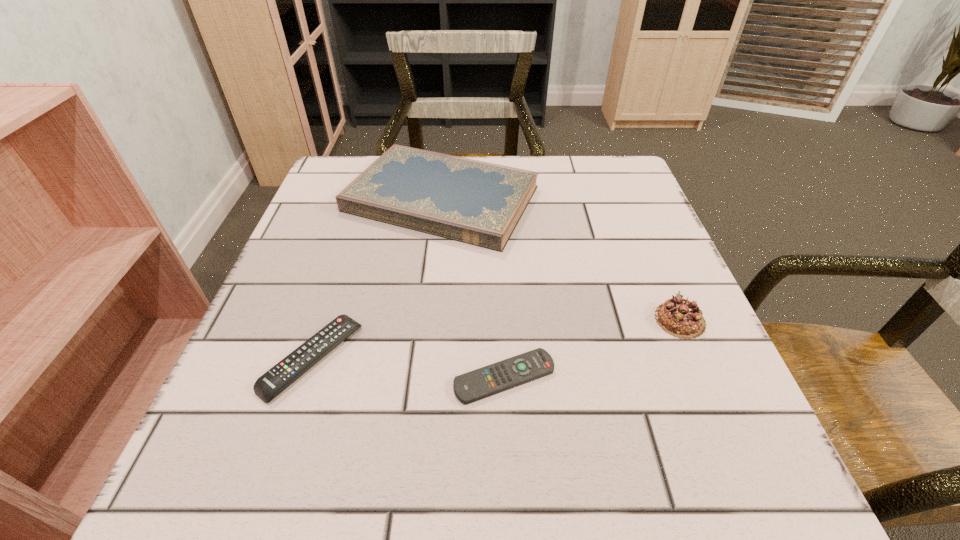
This screenshot has height=540, width=960. I want to click on the farthest object, so click(x=480, y=203).

The height and width of the screenshot is (540, 960). Find the location of `the rightmost object`. the rightmost object is located at coordinates (679, 317).

What are the coordinates of `the left remote control` in the screenshot? It's located at (268, 386).

Locate an element on the screen. The width and height of the screenshot is (960, 540). the second shortest object is located at coordinates (268, 386).

I want to click on the shortest object, so click(x=478, y=384).

You are a GUI agent. You are given a task and a screenshot of the screen. Output one action in this format:
    pyautogui.click(x=<x>, y=<y>)
    Task: Click on the shorter remote control
    
    Given the screenshot: What is the action you would take?
    pyautogui.click(x=478, y=384)

At what (x,y) coordinates should I click in order to perform the action: click on vacant region located on the left of the paperback book. Please return your answer as a coordinate pair (x, y). Looking at the image, I should click on (322, 199).

In order to click on vacant space located on the left of the rightmost object in this screenshot , I will do `click(526, 320)`.

Locate an element on the screen. free space located 0.300m on the back of the taller remote control is located at coordinates (360, 214).

At what (x,y) coordinates should I click in order to perform the action: click on vacant position located 0.230m on the back of the shortest object. Please return your answer as a coordinate pair (x, y). Looking at the image, I should click on (499, 256).